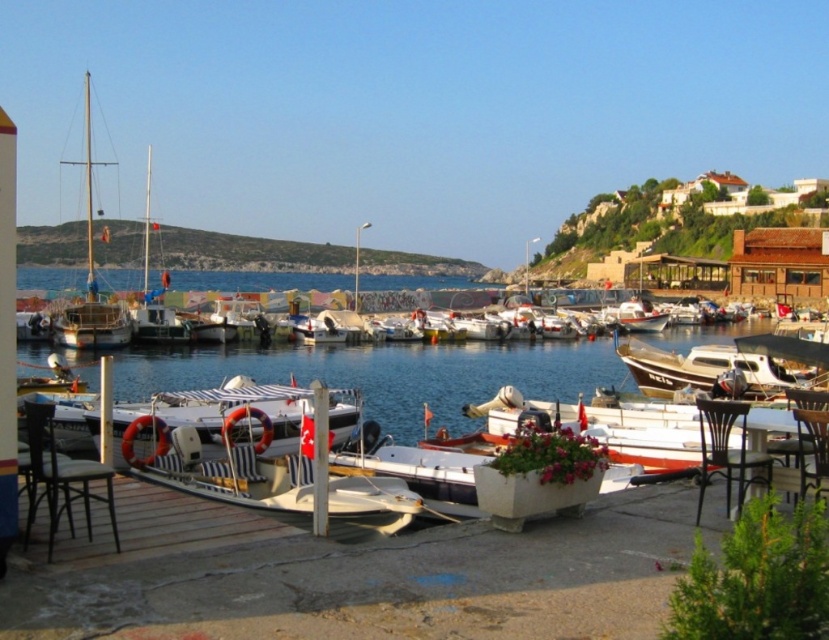
Question: Can you confirm if clear blue water at center is positioned to the left of metallic black chair at lower right?

Choices:
 (A) no
 (B) yes

Answer: (A)

Question: Which point appears farthest from the camera in this image?

Choices:
 (A) (825, 442)
 (B) (376, 413)
 (C) (723, 456)
 (D) (822, 403)

Answer: (B)

Question: Which of the following is the farthest from the observer?

Choices:
 (A) (75, 305)
 (B) (51, 476)
 (C) (308, 458)
 (D) (827, 426)

Answer: (A)

Question: Which object is closer to the camera taking this photo?

Choices:
 (A) wooden chair at lower right
 (B) black leather chair at lower left
 (C) metallic black chair at lower right
 (D) black metal chair at lower right

Answer: (B)

Question: Can you confirm if white glossy boat at center is positioned below black metal chair at lower right?

Choices:
 (A) no
 (B) yes

Answer: (A)

Question: Can you confirm if white glossy boat at center is positioned to the left of wooden chair at lower right?

Choices:
 (A) yes
 (B) no

Answer: (B)